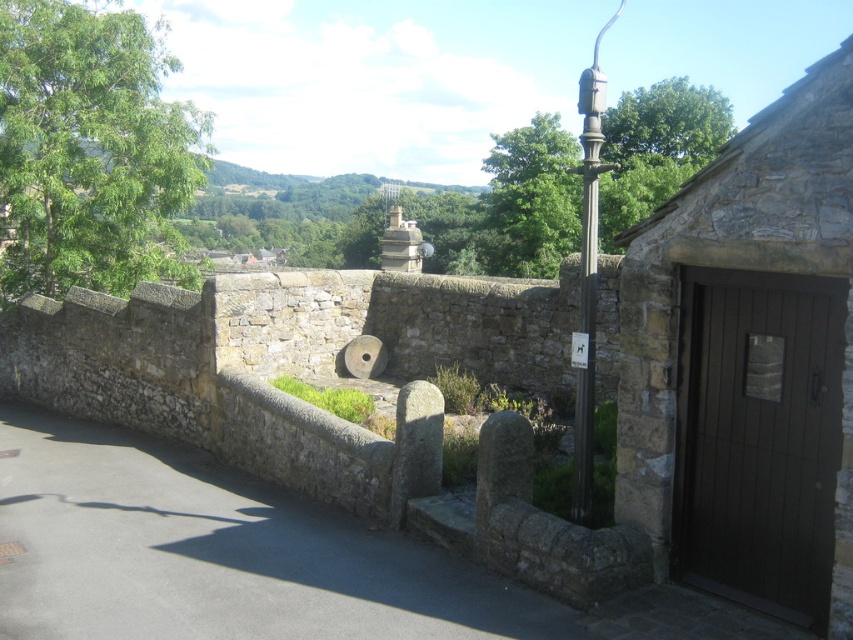
Question: Among these points, which one is farthest from the camera?

Choices:
 (A) (595, 214)
 (B) (595, 244)

Answer: (A)

Question: Which of the following is the closest to the observer?

Choices:
 (A) (575, 442)
 (B) (584, 266)

Answer: (B)

Question: Is polished metal lamp post at center-right to the right of polished stone post at center from the viewer's perspective?

Choices:
 (A) yes
 (B) no

Answer: (A)

Question: Is polished metal lamp post at center-right in front of polished stone post at center?

Choices:
 (A) yes
 (B) no

Answer: (B)

Question: Does polished metal lamp post at center-right have a lesser width compared to polished stone post at center?

Choices:
 (A) yes
 (B) no

Answer: (B)